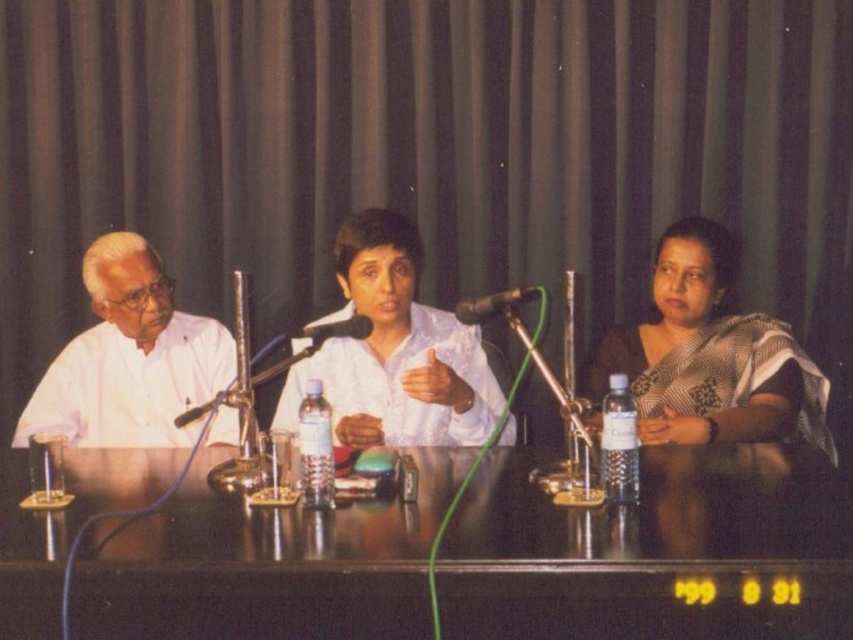
Which is in front, point (757, 621) or point (654, 260)?

Point (757, 621) is in front.

Is black glossy table at center wider than black and white saree at right?

Correct, the width of black glossy table at center exceeds that of black and white saree at right.

Does point (381, 573) come in front of point (664, 324)?

Yes, point (381, 573) is in front of point (664, 324).

The image size is (853, 640). Identify the location of black glossy table at center. (651, 550).

Measure the distance from white glossy shirt at center to white matte shirt at left.

white glossy shirt at center is 43.95 centimeters away from white matte shirt at left.

Locate an element on the screen. The width and height of the screenshot is (853, 640). white glossy shirt at center is located at coordinates (393, 352).

Is point (590, 4) positioned after point (596, 611)?

Yes, it is behind point (596, 611).

Which is in front, point (405, 49) or point (234, 570)?

Positioned in front is point (234, 570).

You are a GUI agent. You are given a task and a screenshot of the screen. Output one action in this format:
    pyautogui.click(x=<x>, y=<y>)
    Task: Click on the matte black curtain at upper center
    
    Given the screenshot: What is the action you would take?
    (419, 148)